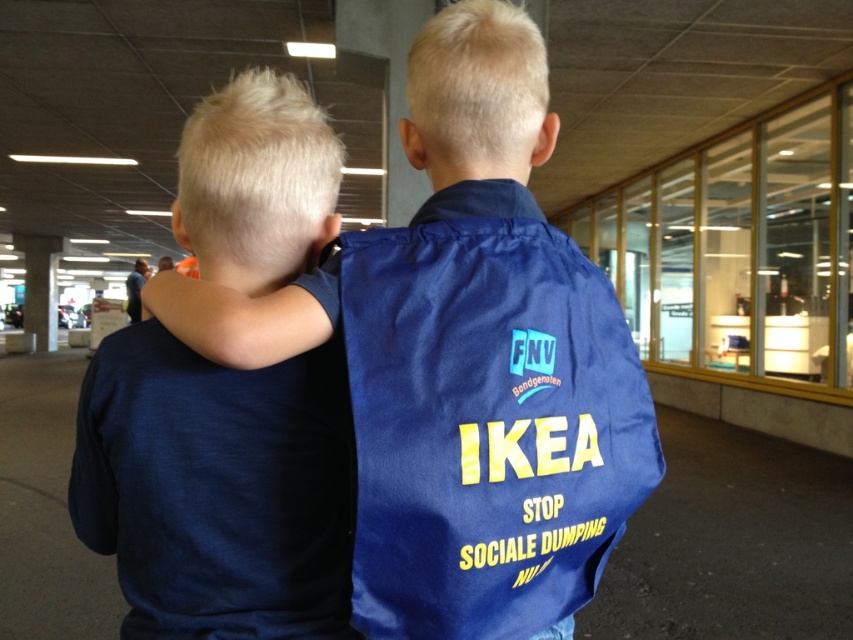
Question: Is navy blue shirt at center behind dark blue t-shirt at center?

Choices:
 (A) yes
 (B) no

Answer: (B)

Question: Among these objects, which one is farthest from the camera?

Choices:
 (A) navy blue shirt at center
 (B) smooth concrete pillar at center
 (C) blue fabric bag at center
 (D) dark blue t-shirt at center

Answer: (B)

Question: Can you confirm if navy blue shirt at center is positioned below dark blue t-shirt at center?

Choices:
 (A) no
 (B) yes

Answer: (A)

Question: Which of the following is the closest to the observer?

Choices:
 (A) blue fabric bag at center
 (B) dark blue t-shirt at center

Answer: (A)

Question: Does navy blue shirt at center lie in front of smooth concrete pillar at center?

Choices:
 (A) yes
 (B) no

Answer: (A)

Question: Which object is closer to the camera taking this photo?

Choices:
 (A) dark blue t-shirt at center
 (B) navy blue shirt at center
 (C) blue fabric bag at center

Answer: (B)